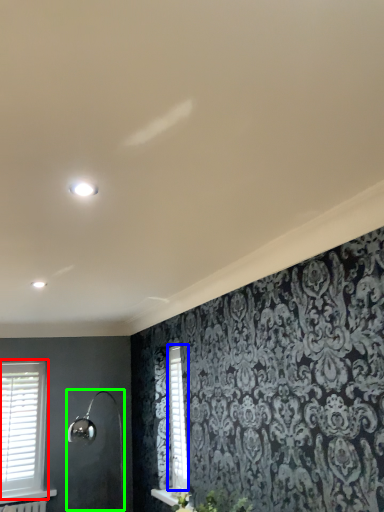
Question: Estimate the real-world distances between objects in this image. Which object is farther from window (highlighted by a red box), shutter (highlighted by a blue box) or shower (highlighted by a green box)?

Choices:
 (A) shutter
 (B) shower

Answer: (A)